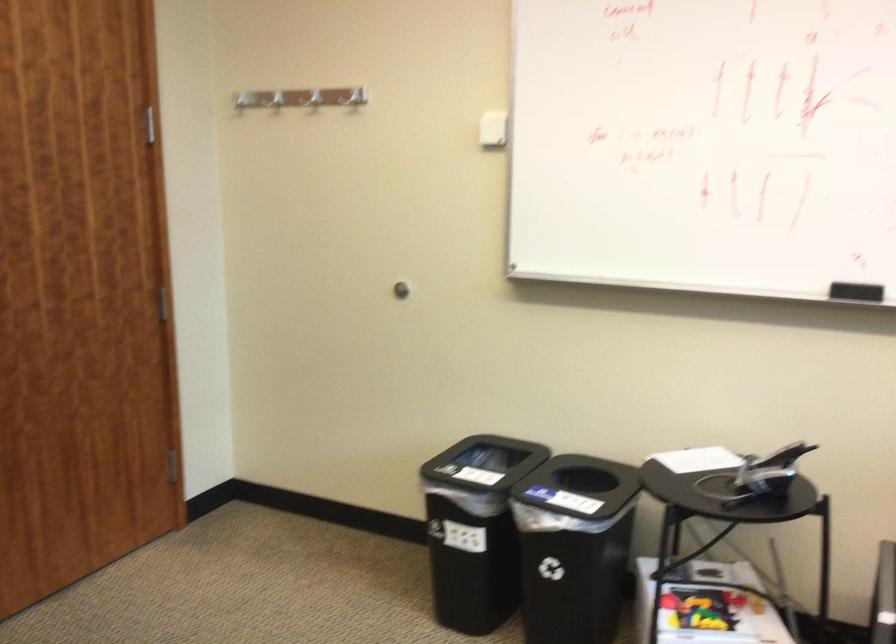
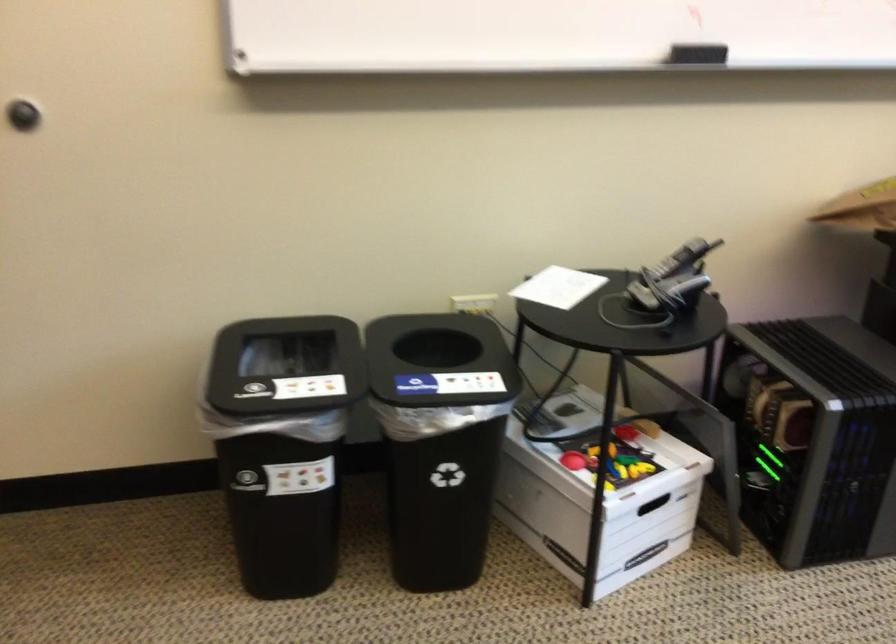
Where in the second image is the point corresponding to (696,459) from the first image?

(558, 287)